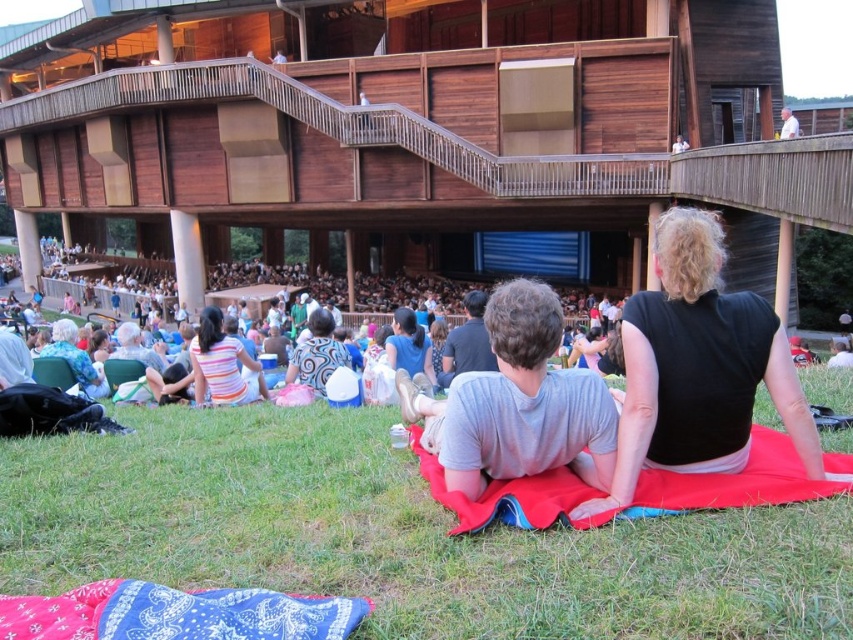
You are standing in the outdoor theater area and see the green grass at lower center and the swirled fabric dress at center. Which object is positioned to the right of the other?

The green grass at lower center is to the right of the swirled fabric dress at center.

You are a photographer taking a picture of the scene. You want to ensure that the red fabric blanket at lower center is visible underneath the swirled fabric dress at center. Is the current arrangement allowing this?

Yes, the red fabric blanket at lower center is positioned under the swirled fabric dress at center, so it is visible underneath.

You are standing at the entrance of the theater and want to find the red fabric blanket at lower center. According to the coordinates provided, where should you look relative to the entrance?

The red fabric blanket at lower center is located at point 0.758 on the x axis and 0.852 on the y axis, so you should look towards the lower center area of the image, which would be to the right and slightly below the entrance point.